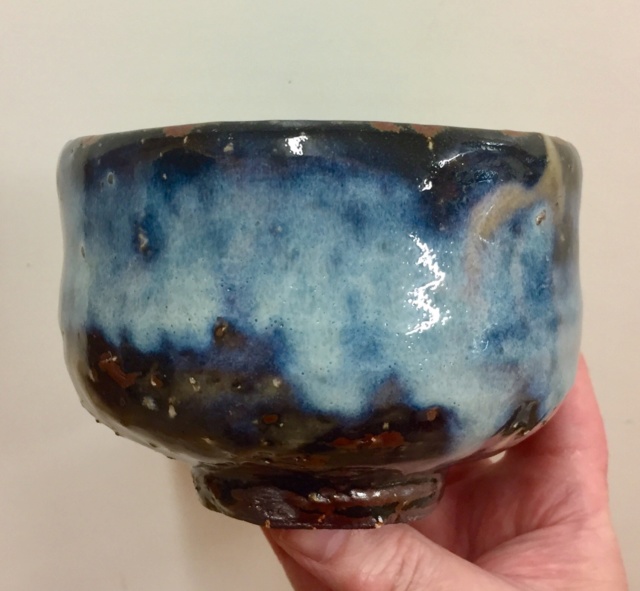
Locate an element on the screen. The height and width of the screenshot is (591, 640). top of bowl is located at coordinates (313, 124).